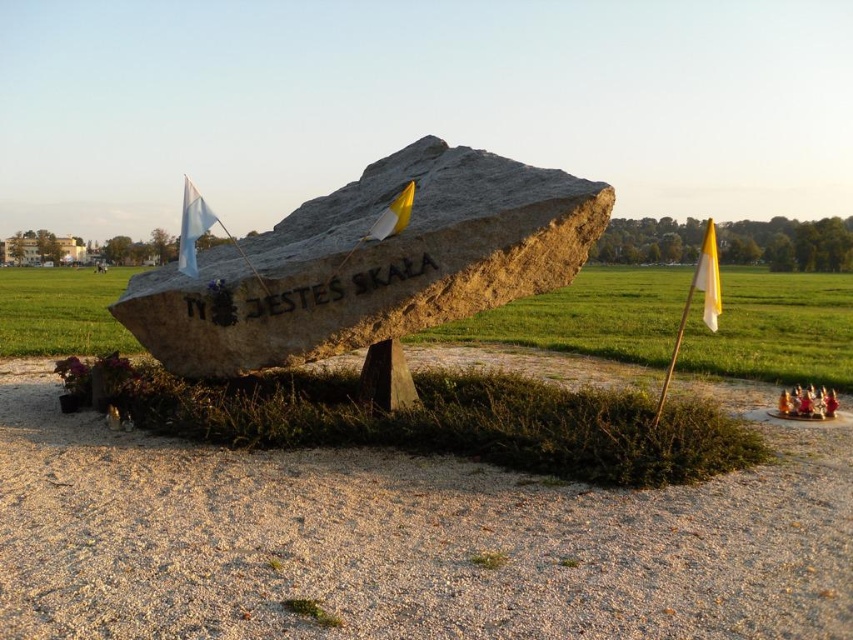
You are standing in front of the monument and want to place a small flag on the dirt gravel at center. Can you place it directly on top of the gray stone boulder at center?

The dirt gravel at center is below gray stone boulder at center, so you cannot place the flag on the dirt gravel at center directly on top of the gray stone boulder at center because the dirt gravel is underneath the boulder.

What are the coordinates of the gray stone boulder at center?

The gray stone boulder at center is located at coordinates (370, 262).

You are standing in front of the large rock monument and want to take a photo. You notice two specific points marked on the rock surface at coordinates point (102,582) and point (38,296). Which of these points will appear larger in your photo?

Point (102,582) will appear larger in the photo because it is closer to the camera than point (38,296).